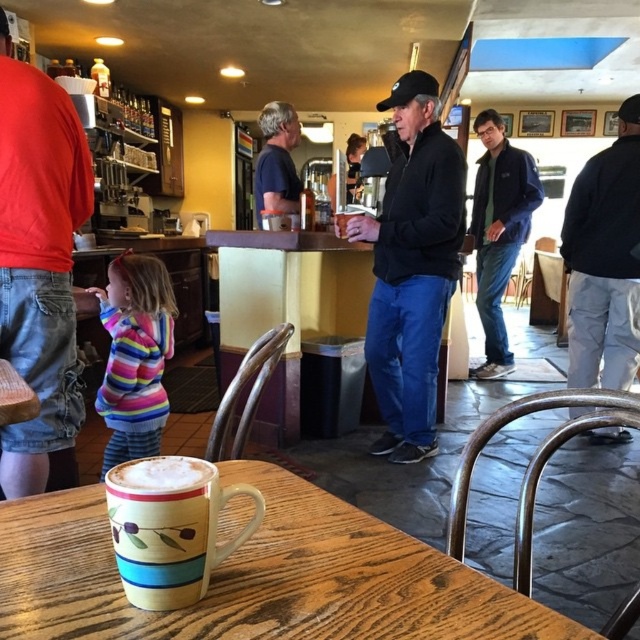
What is located at the coordinate point [604,260] in the image?

The dark blue jacket at right is located at point [604,260].

You are a barista at the counter and need to hand a coffee to both the dark blue jacket at right and the dark blue jacket at center. Which customer should you serve first if you want to avoid bending down too much?

You should serve the dark blue jacket at center first because the dark blue jacket at right is shorter, so serving the taller one first would require less bending.

Looking at this image, you are at the point labeled point (x=29, y=152) and want to walk to the exit located at point (x=109, y=474). Is there a clear path between these two points?

Point (x=29, y=152) is behind point (x=109, y=474), so there is a clear path between them.